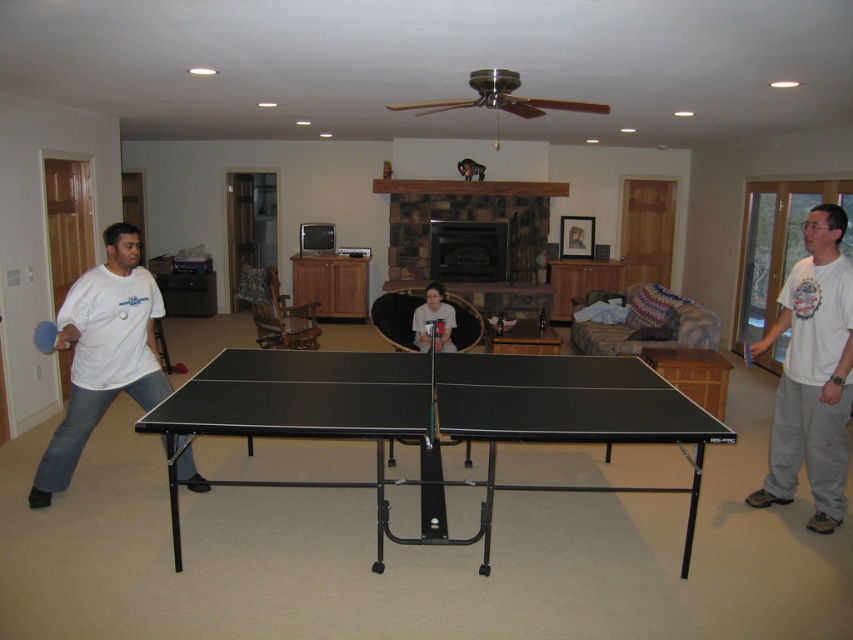
Question: Can you confirm if white cotton shirt at right is wider than matte white shirt at center?

Choices:
 (A) no
 (B) yes

Answer: (B)

Question: Which of the following is the closest to the observer?

Choices:
 (A) matte white shirt at center
 (B) matte white shirt at left
 (C) blue rubber table tennis at center
 (D) blue foam paddle at left

Answer: (D)

Question: Does matte white shirt at center come in front of blue foam paddle at left?

Choices:
 (A) no
 (B) yes

Answer: (A)

Question: Based on their relative distances, which object is nearer to the matte white shirt at center?

Choices:
 (A) matte white shirt at left
 (B) black matte table tennis table at center
 (C) blue rubber table tennis at center

Answer: (B)

Question: From the image, what is the correct spatial relationship of blue foam paddle at left in relation to blue rubber table tennis at center?

Choices:
 (A) above
 (B) below

Answer: (A)

Question: Which point appears farthest from the camera in this image?

Choices:
 (A) 415,340
 (B) 834,324

Answer: (A)